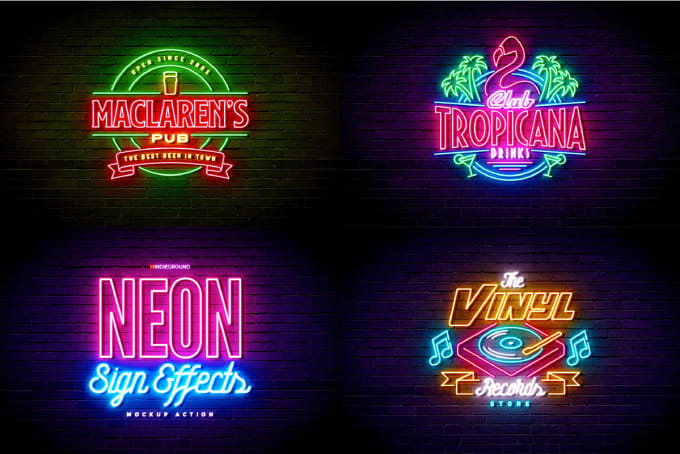
This screenshot has height=454, width=680. I want to click on record player, so click(504, 343).